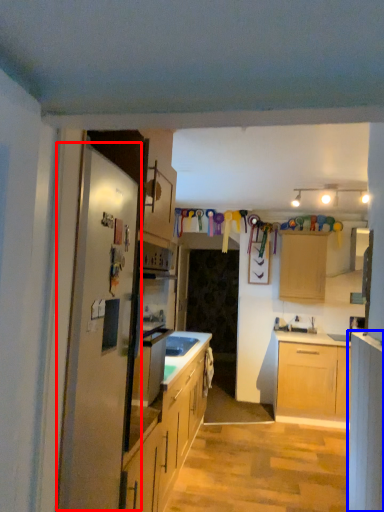
Question: Which of the following is the farthest to the observer, fridge (highlighted by a red box) or cabinetry (highlighted by a blue box)?

Choices:
 (A) fridge
 (B) cabinetry

Answer: (B)